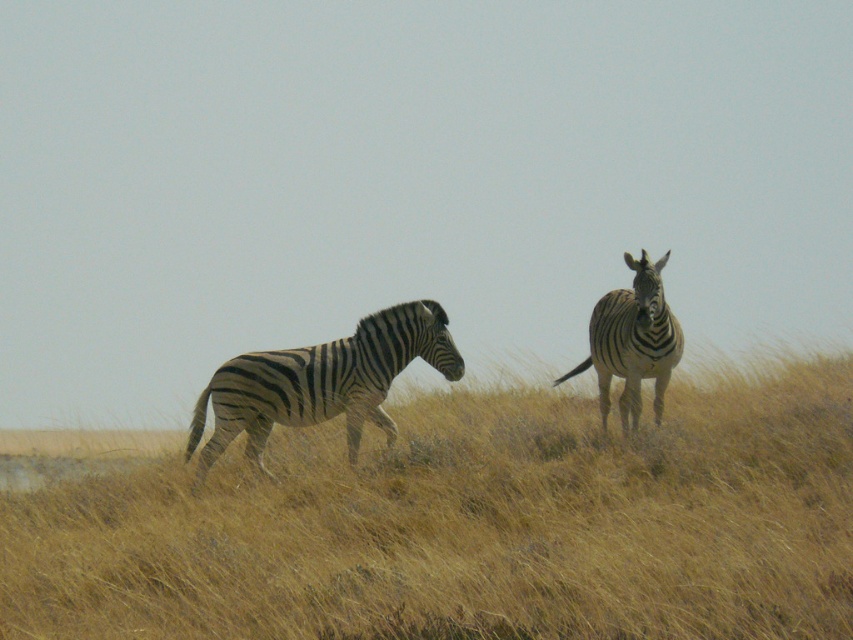
Does point (321, 412) lie behind point (659, 406)?

That is False.

At what (x,y) coordinates should I click in order to perform the action: click on black and white striped zebra at left. Please return your answer as a coordinate pair (x, y). The width and height of the screenshot is (853, 640). Looking at the image, I should click on (321, 381).

This screenshot has width=853, height=640. Identify the location of black and white striped zebra at left. (321, 381).

Find the location of a particular element. This screenshot has width=853, height=640. black and white striped zebra at left is located at coordinates (321, 381).

Which is below, dry grass at center or black and white striped zebra at left?

dry grass at center is lower down.

Is dry grass at center wider than black and white striped zebra at left?

Yes.

What do you see at coordinates (469, 525) in the screenshot? I see `dry grass at center` at bounding box center [469, 525].

Identify the location of dry grass at center. Image resolution: width=853 pixels, height=640 pixels. (469, 525).

Between point (3, 611) and point (666, 360), which one is positioned in front?

Point (3, 611) is more forward.

Is point (751, 545) less distant than point (619, 374)?

Yes, it is.

Does point (76, 538) come in front of point (625, 346)?

Yes, point (76, 538) is in front of point (625, 346).

At what (x,y) coordinates should I click in order to perform the action: click on dry grass at center. Please return your answer as a coordinate pair (x, y). This screenshot has height=640, width=853. Looking at the image, I should click on point(469,525).